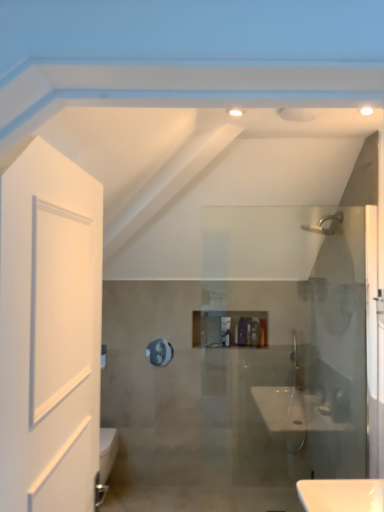
Question: Is matte silver faucet at upper right further to the viewer compared to metallic reflective mirror at center?

Choices:
 (A) no
 (B) yes

Answer: (A)

Question: Does matte silver faucet at upper right turn towards metallic reflective mirror at center?

Choices:
 (A) no
 (B) yes

Answer: (A)

Question: Is matte silver faucet at upper right at the left side of metallic reflective mirror at center?

Choices:
 (A) no
 (B) yes

Answer: (A)

Question: From the image's perspective, does matte silver faucet at upper right appear higher than metallic reflective mirror at center?

Choices:
 (A) yes
 (B) no

Answer: (A)

Question: Considering the relative sizes of matte silver faucet at upper right and metallic reflective mirror at center in the image provided, is matte silver faucet at upper right smaller than metallic reflective mirror at center?

Choices:
 (A) no
 (B) yes

Answer: (A)

Question: Is matte silver faucet at upper right positioned in front of metallic reflective mirror at center?

Choices:
 (A) no
 (B) yes

Answer: (B)

Question: Is matte purple bottle at center to the left of metallic reflective mirror at center from the viewer's perspective?

Choices:
 (A) yes
 (B) no

Answer: (B)

Question: From the image's perspective, is matte purple bottle at center beneath metallic reflective mirror at center?

Choices:
 (A) yes
 (B) no

Answer: (B)

Question: Can you see matte purple bottle at center touching metallic reflective mirror at center?

Choices:
 (A) no
 (B) yes

Answer: (A)

Question: Would you say matte purple bottle at center is a long distance from metallic reflective mirror at center?

Choices:
 (A) no
 (B) yes

Answer: (A)

Question: Is matte purple bottle at center positioned behind metallic reflective mirror at center?

Choices:
 (A) yes
 (B) no

Answer: (B)

Question: Considering the relative sizes of matte purple bottle at center and metallic reflective mirror at center in the image provided, is matte purple bottle at center thinner than metallic reflective mirror at center?

Choices:
 (A) no
 (B) yes

Answer: (A)

Question: Is matte silver faucet at upper right with matte purple bottle at center?

Choices:
 (A) yes
 (B) no

Answer: (B)